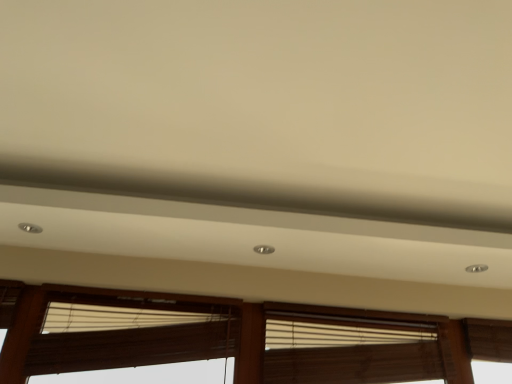
Question: Is wooden blinds at lower center taller or shorter than wooden blinds at center, the second window blind in the left-to-right sequence?

Choices:
 (A) tall
 (B) short

Answer: (A)

Question: Considering the positions of wooden blinds at lower center and wooden blinds at center, which ranks as the first window blind in right-to-left order, in the image, is wooden blinds at lower center bigger or smaller than wooden blinds at center, which ranks as the first window blind in right-to-left order,?

Choices:
 (A) small
 (B) big

Answer: (B)

Question: Considering the real-world distances, which object is closest to the wooden blinds at lower center?

Choices:
 (A) wooden blinds at center, which ranks as the first window blind in right-to-left order
 (B) brown fabric window blind at lower center, which is the second window blind in right-to-left order

Answer: (B)

Question: Which object is positioned farthest from the brown fabric window blind at lower center, which ranks as the first window blind in left-to-right order?

Choices:
 (A) wooden blinds at center, the second window blind in the left-to-right sequence
 (B) wooden blinds at lower center

Answer: (A)